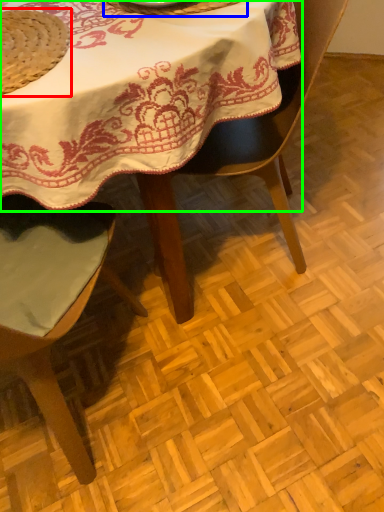
Question: Considering the real-world distances, which object is farthest from straw hat (highlighted by a red box)? tableware (highlighted by a blue box) or table (highlighted by a green box)?

Choices:
 (A) tableware
 (B) table

Answer: (A)